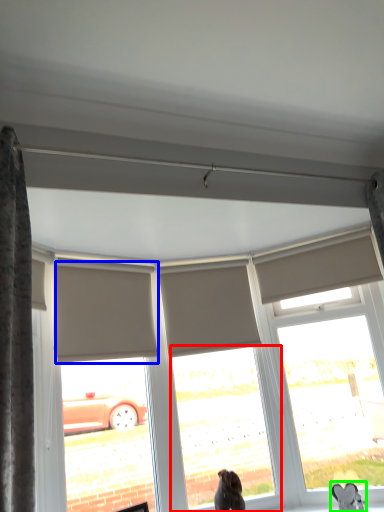
Question: Which object is the farthest from window (highlighted by a red box)? Choose among these: shutter (highlighted by a blue box) or animal (highlighted by a green box).

Choices:
 (A) shutter
 (B) animal

Answer: (B)